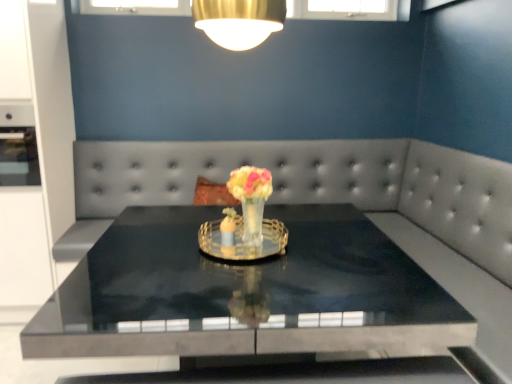
I want to click on free space in front of translucent glass vase at center, so click(x=256, y=272).